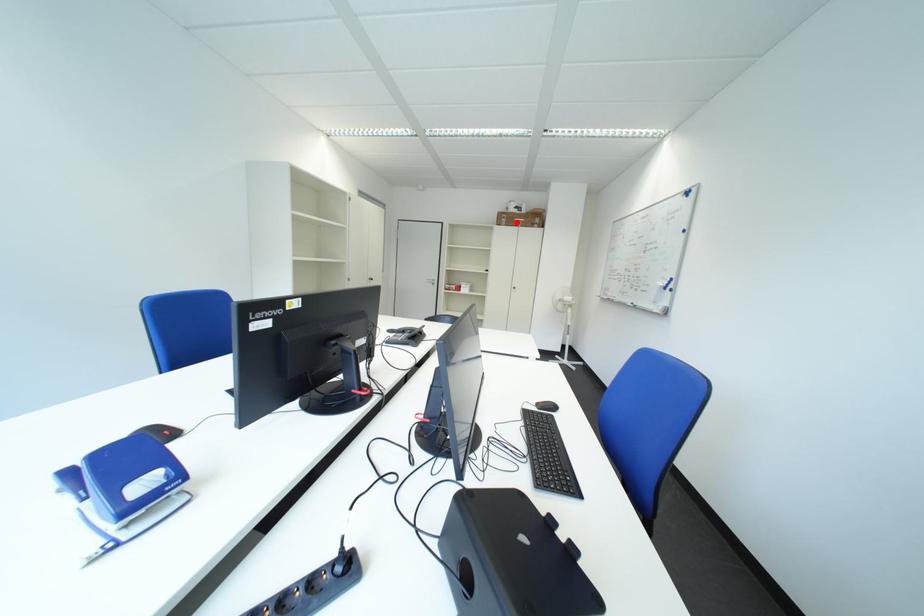
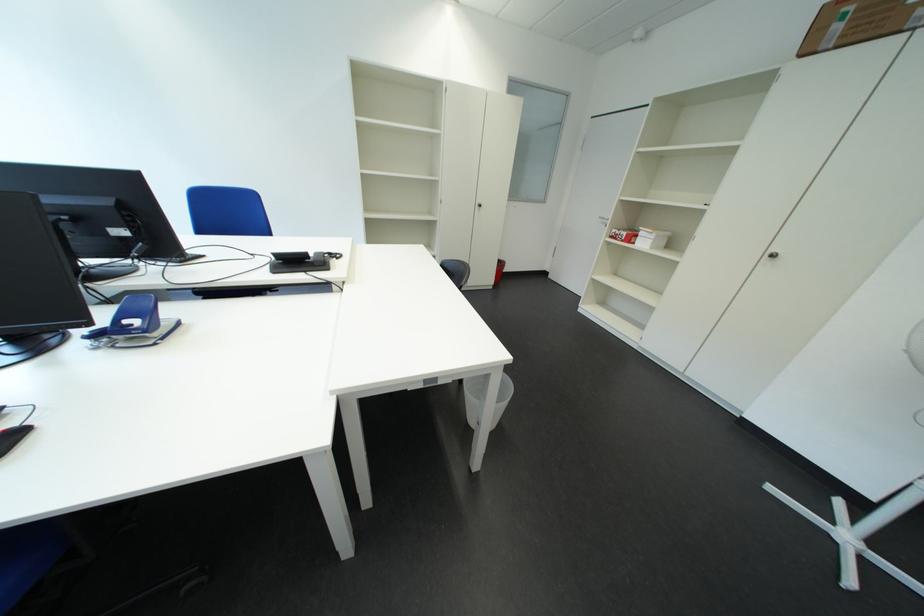
Where in the second image is the point corresponding to the highlighted location from the first image?

(849, 30)